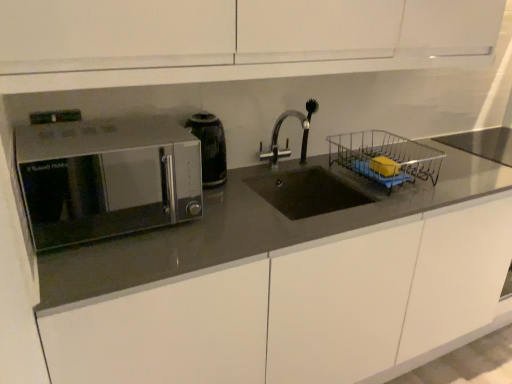
Question: Considering the relative sizes of black glossy electric kettle at center-left and satin metallic microwave at left in the image provided, is black glossy electric kettle at center-left bigger than satin metallic microwave at left?

Choices:
 (A) yes
 (B) no

Answer: (B)

Question: Is black glossy electric kettle at center-left oriented away from satin metallic microwave at left?

Choices:
 (A) no
 (B) yes

Answer: (A)

Question: Considering the relative sizes of black glossy electric kettle at center-left and satin metallic microwave at left in the image provided, is black glossy electric kettle at center-left shorter than satin metallic microwave at left?

Choices:
 (A) yes
 (B) no

Answer: (A)

Question: Considering the relative sizes of black glossy electric kettle at center-left and satin metallic microwave at left in the image provided, is black glossy electric kettle at center-left taller than satin metallic microwave at left?

Choices:
 (A) yes
 (B) no

Answer: (B)

Question: Can satin metallic microwave at left be found inside black glossy electric kettle at center-left?

Choices:
 (A) no
 (B) yes

Answer: (A)

Question: Is black glossy electric kettle at center-left placed right next to satin metallic microwave at left?

Choices:
 (A) yes
 (B) no

Answer: (B)

Question: Can you confirm if silver metallic faucet at center is thinner than satin silver microwave at left?

Choices:
 (A) no
 (B) yes

Answer: (B)

Question: Is silver metallic faucet at center directly adjacent to satin silver microwave at left?

Choices:
 (A) no
 (B) yes

Answer: (A)

Question: Can you confirm if silver metallic faucet at center is smaller than satin silver microwave at left?

Choices:
 (A) yes
 (B) no

Answer: (A)

Question: Does silver metallic faucet at center lie in front of satin silver microwave at left?

Choices:
 (A) yes
 (B) no

Answer: (B)

Question: From the image's perspective, is silver metallic faucet at center above satin silver microwave at left?

Choices:
 (A) no
 (B) yes

Answer: (B)

Question: Considering the relative sizes of silver metallic faucet at center and satin silver microwave at left in the image provided, is silver metallic faucet at center taller than satin silver microwave at left?

Choices:
 (A) no
 (B) yes

Answer: (A)

Question: Is silver metallic faucet at center in front of satin metallic microwave at left?

Choices:
 (A) yes
 (B) no

Answer: (B)